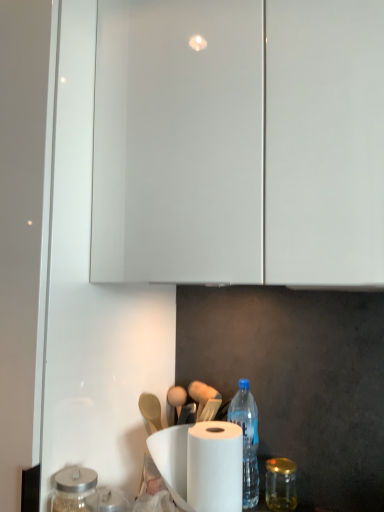
Question: Does gold metallic jar at lower right, which ranks as the first glass jar in right-to-left order, have a larger size compared to transparent glass jar at lower left, arranged as the 2th glass jar when viewed from the right?

Choices:
 (A) no
 (B) yes

Answer: (A)

Question: Is gold metallic jar at lower right, which appears as the second glass jar when viewed from the front, at the left side of transparent glass jar at lower left, which ranks as the second glass jar in back-to-front order?

Choices:
 (A) no
 (B) yes

Answer: (A)

Question: From the image's perspective, is gold metallic jar at lower right, which ranks as the first glass jar in back-to-front order, located beneath transparent glass jar at lower left, marked as the first glass jar in a left-to-right arrangement?

Choices:
 (A) yes
 (B) no

Answer: (A)

Question: From a real-world perspective, does gold metallic jar at lower right, which ranks as the first glass jar in back-to-front order, sit lower than transparent glass jar at lower left, arranged as the 2th glass jar when viewed from the right?

Choices:
 (A) yes
 (B) no

Answer: (A)

Question: Considering the relative positions of gold metallic jar at lower right, which appears as the second glass jar when viewed from the front, and transparent glass jar at lower left, which ranks as the second glass jar in back-to-front order, in the image provided, is gold metallic jar at lower right, which appears as the second glass jar when viewed from the front, behind transparent glass jar at lower left, which ranks as the second glass jar in back-to-front order,?

Choices:
 (A) no
 (B) yes

Answer: (B)

Question: Is gold metallic jar at lower right, which appears as the second glass jar when viewed from the front, turned away from transparent glass jar at lower left, which ranks as the second glass jar in back-to-front order?

Choices:
 (A) no
 (B) yes

Answer: (A)

Question: Is transparent glass jar at lower left, the first glass jar in the front-to-back sequence, wider than blue plastic bottle at lower center?

Choices:
 (A) no
 (B) yes

Answer: (A)

Question: Considering the relative positions of transparent glass jar at lower left, which ranks as the second glass jar in back-to-front order, and blue plastic bottle at lower center in the image provided, is transparent glass jar at lower left, which ranks as the second glass jar in back-to-front order, in front of blue plastic bottle at lower center?

Choices:
 (A) yes
 (B) no

Answer: (A)

Question: Is transparent glass jar at lower left, arranged as the 2th glass jar when viewed from the right, outside blue plastic bottle at lower center?

Choices:
 (A) no
 (B) yes

Answer: (B)

Question: Does transparent glass jar at lower left, the first glass jar in the front-to-back sequence, appear on the right side of blue plastic bottle at lower center?

Choices:
 (A) yes
 (B) no

Answer: (B)

Question: Is transparent glass jar at lower left, the first glass jar in the front-to-back sequence, at the left side of blue plastic bottle at lower center?

Choices:
 (A) no
 (B) yes

Answer: (B)

Question: Is transparent glass jar at lower left, arranged as the 2th glass jar when viewed from the right, taller than blue plastic bottle at lower center?

Choices:
 (A) yes
 (B) no

Answer: (B)

Question: Are blue plastic bottle at lower center and gold metallic jar at lower right, which appears as the second glass jar when viewed from the front, making contact?

Choices:
 (A) no
 (B) yes

Answer: (A)